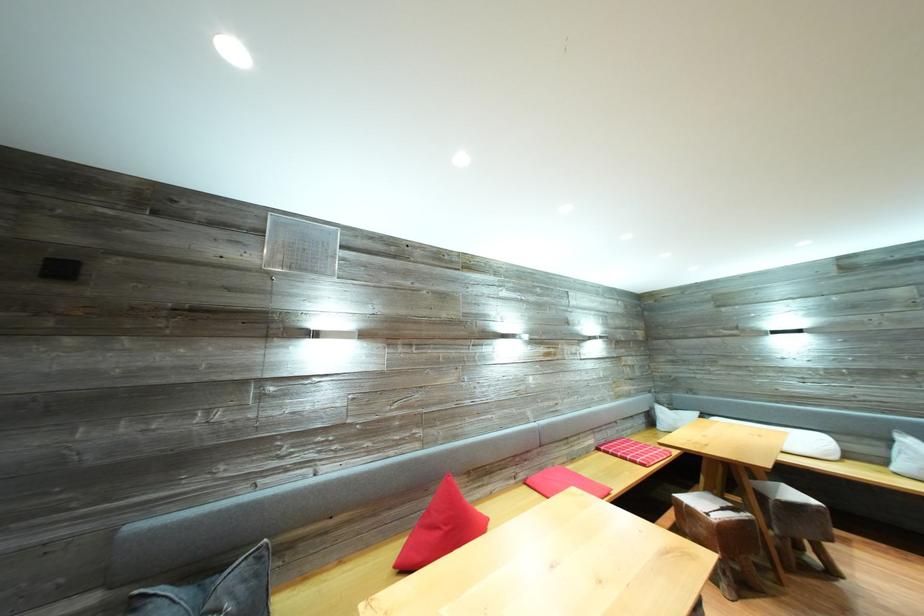
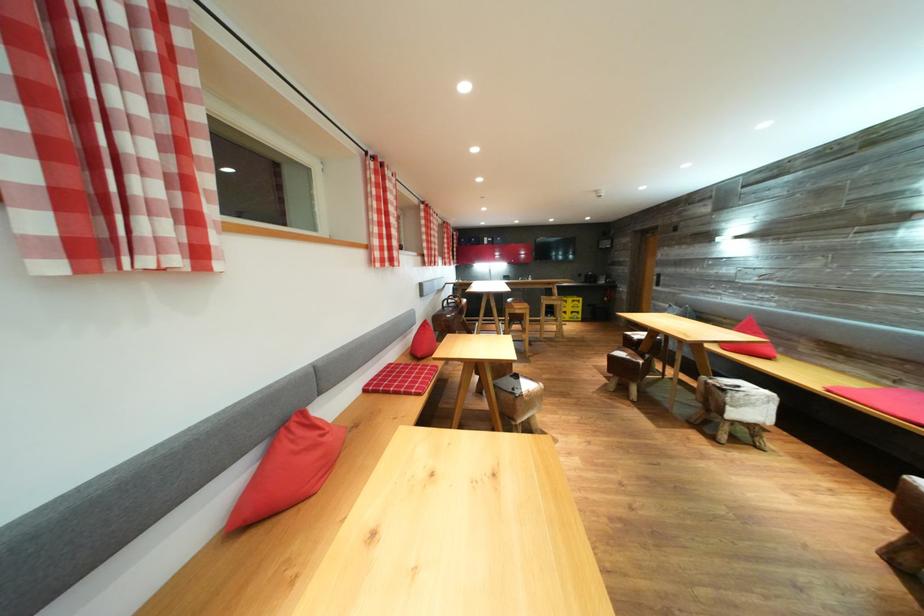
Question: I am providing you with two images of the same scene from different viewpoints. Which of the following objects are not visible in image2?

Choices:
 (A) bench sitting surface
 (B) bar stool sitting surface
 (C) brown leather stool
 (D) none of these

Answer: (D)